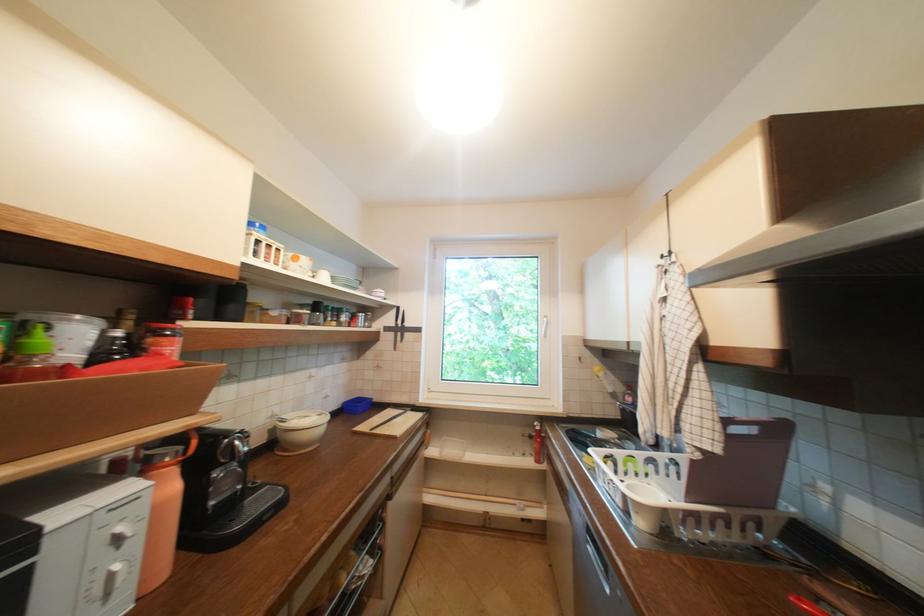
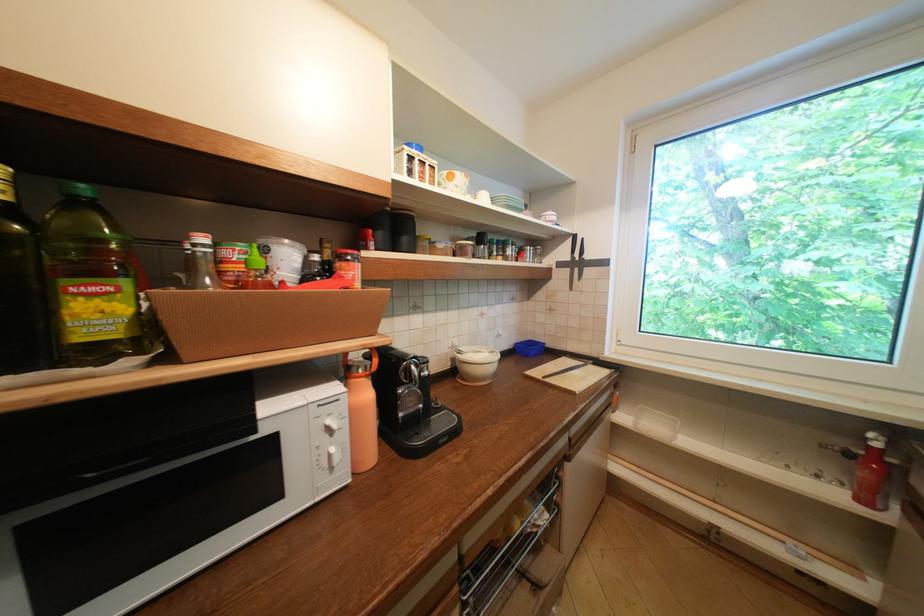
Question: The camera is either moving clockwise (left) or counter-clockwise (right) around the object. The first image is from the beginning of the video and the second image is from the end. Is the camera moving left or right when shooting the video?

Choices:
 (A) Left
 (B) Right

Answer: (B)